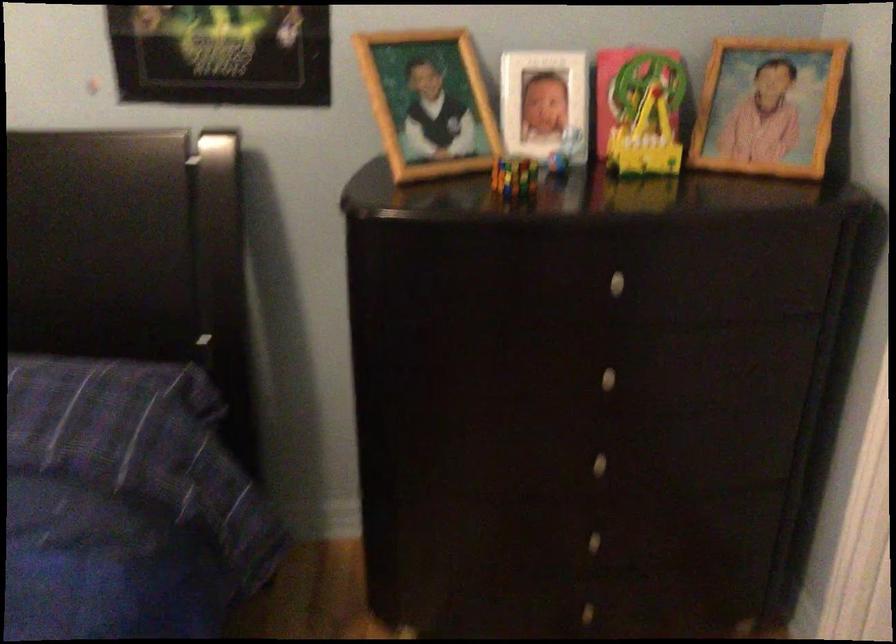
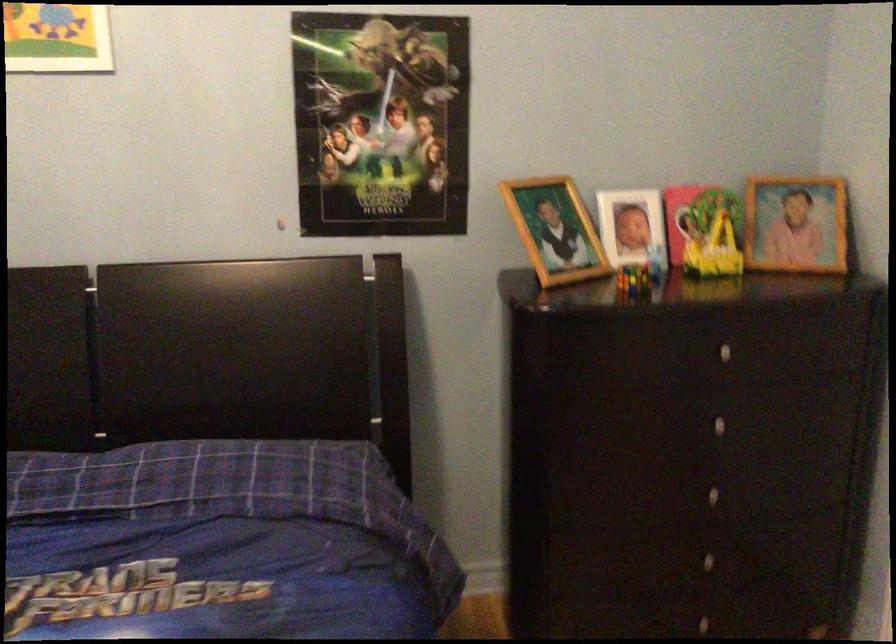
The point at (763, 111) is marked in the first image. Where is the corresponding point in the second image?

(796, 223)